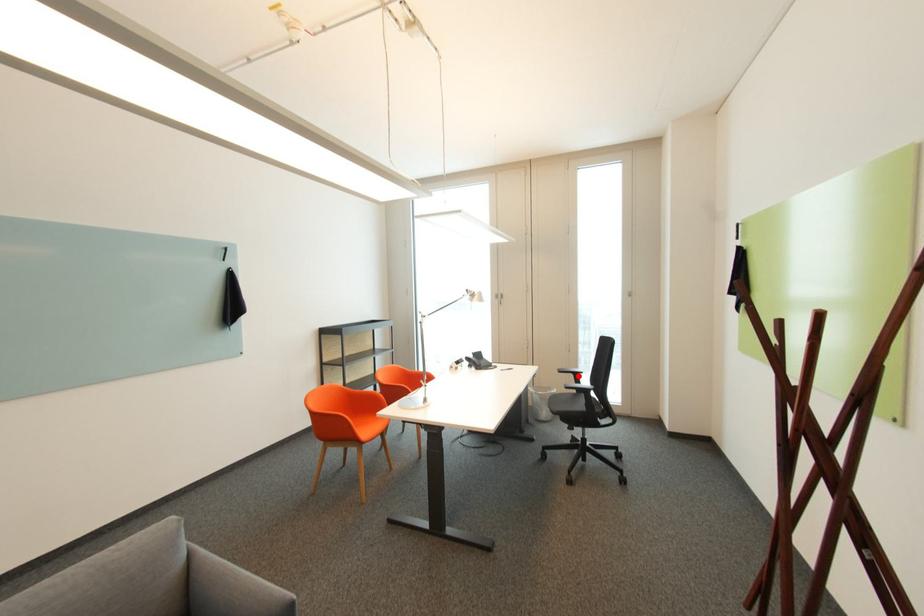
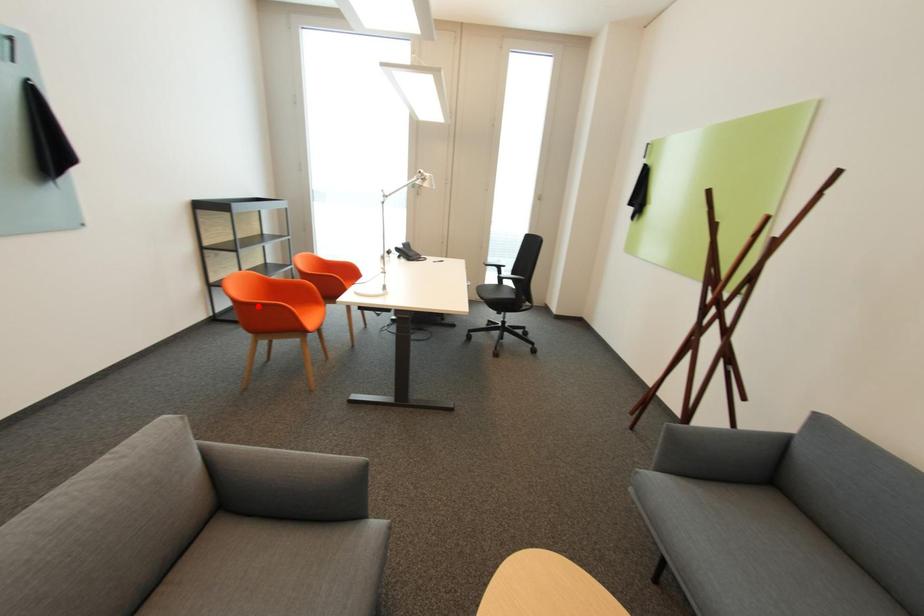
I am providing you with two images of the same scene from different viewpoints. A red point is marked on the first image and another point is marked on the second image. Do the highlighted points in image1 and image2 indicate the same real-world spot?

No